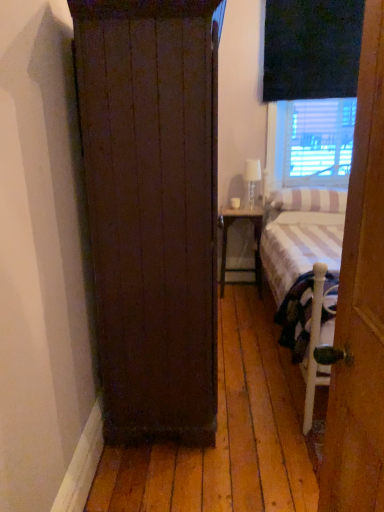
Question: Would you say white striped pillow at right is part of clear glass lamp at upper right's contents?

Choices:
 (A) yes
 (B) no

Answer: (B)

Question: From a real-world perspective, is clear glass lamp at upper right over white striped pillow at right?

Choices:
 (A) yes
 (B) no

Answer: (A)

Question: Does clear glass lamp at upper right have a smaller size compared to white striped pillow at right?

Choices:
 (A) yes
 (B) no

Answer: (A)

Question: From the image's perspective, does clear glass lamp at upper right appear lower than white striped pillow at right?

Choices:
 (A) yes
 (B) no

Answer: (B)

Question: Does clear glass lamp at upper right have a greater height compared to white striped pillow at right?

Choices:
 (A) yes
 (B) no

Answer: (A)

Question: Considering the relative sizes of clear glass lamp at upper right and white striped pillow at right in the image provided, is clear glass lamp at upper right shorter than white striped pillow at right?

Choices:
 (A) yes
 (B) no

Answer: (B)

Question: Can you confirm if white striped fabric bed at right is wider than matte white wood nightstand at center?

Choices:
 (A) yes
 (B) no

Answer: (A)

Question: From the image's perspective, does white striped fabric bed at right appear lower than matte white wood nightstand at center?

Choices:
 (A) no
 (B) yes

Answer: (B)

Question: Can you confirm if white striped fabric bed at right is positioned to the right of matte white wood nightstand at center?

Choices:
 (A) no
 (B) yes

Answer: (B)

Question: Considering the relative sizes of white striped fabric bed at right and matte white wood nightstand at center in the image provided, is white striped fabric bed at right bigger than matte white wood nightstand at center?

Choices:
 (A) yes
 (B) no

Answer: (A)

Question: Is white striped fabric bed at right taller than matte white wood nightstand at center?

Choices:
 (A) no
 (B) yes

Answer: (B)

Question: From a real-world perspective, is white striped fabric bed at right over matte white wood nightstand at center?

Choices:
 (A) yes
 (B) no

Answer: (A)

Question: Is wooden door at right wider than clear glass lamp at upper right?

Choices:
 (A) yes
 (B) no

Answer: (A)